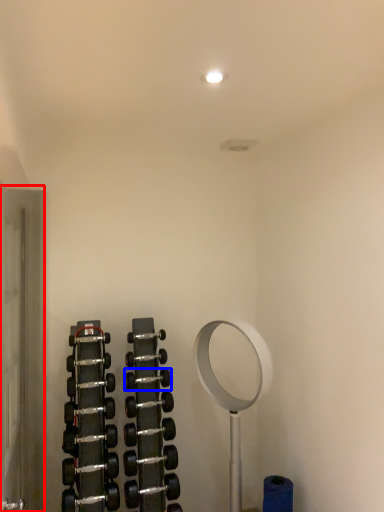
Question: Which object is further to the camera taking this photo, glass door (highlighted by a red box) or dumbbell (highlighted by a blue box)?

Choices:
 (A) glass door
 (B) dumbbell

Answer: (B)